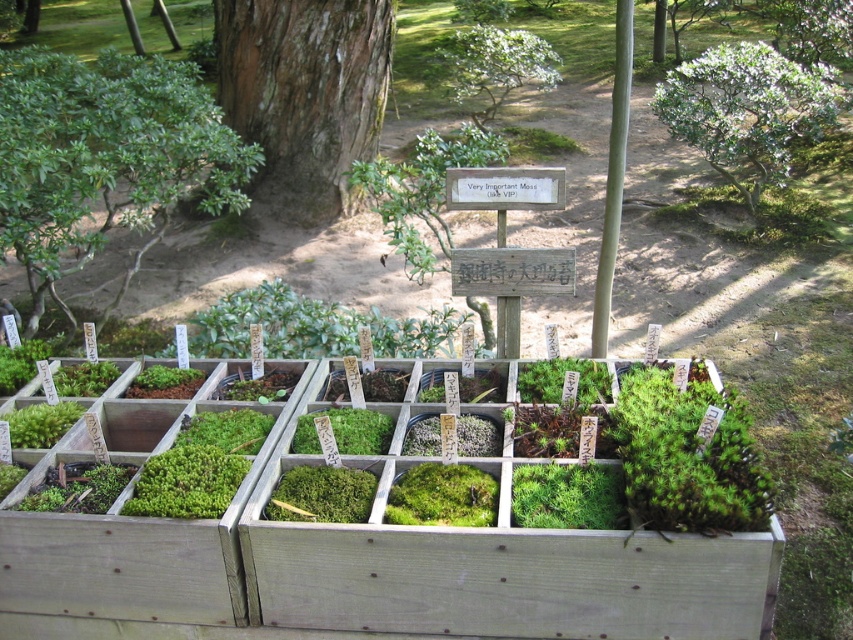
Question: Which of these objects is positioned farthest from the green leafy shrub at upper right?

Choices:
 (A) green leafy shrub at left
 (B) green leafy tree at upper center
 (C) smooth brown bark at center

Answer: (A)

Question: Estimate the real-world distances between objects in this image. Which object is closer to the smooth brown bark at center?

Choices:
 (A) green leafy tree at upper center
 (B) green leafy shrub at upper right
 (C) green leafy shrub at left

Answer: (C)

Question: Is green leafy shrub at left further to camera compared to smooth brown bark at center?

Choices:
 (A) yes
 (B) no

Answer: (B)

Question: Is smooth brown bark at center to the right of green leafy tree at upper center from the viewer's perspective?

Choices:
 (A) no
 (B) yes

Answer: (A)

Question: In this image, where is smooth brown bark at center located relative to green leafy shrub at upper right?

Choices:
 (A) left
 (B) right

Answer: (A)

Question: Among these objects, which one is nearest to the camera?

Choices:
 (A) green leafy shrub at upper right
 (B) smooth brown bark at center
 (C) green leafy shrub at left
 (D) green leafy tree at upper center

Answer: (C)